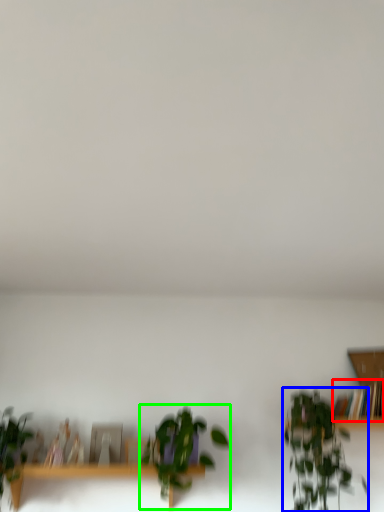
Question: Which object is the closest to the book (highlighted by a red box)? Choose among these: houseplant (highlighted by a blue box) or houseplant (highlighted by a green box).

Choices:
 (A) houseplant
 (B) houseplant

Answer: (A)